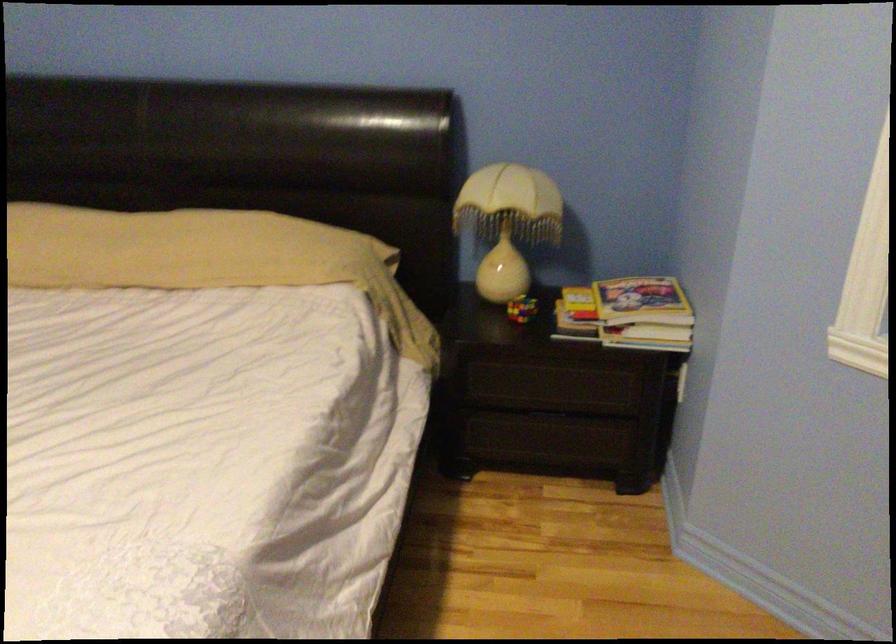
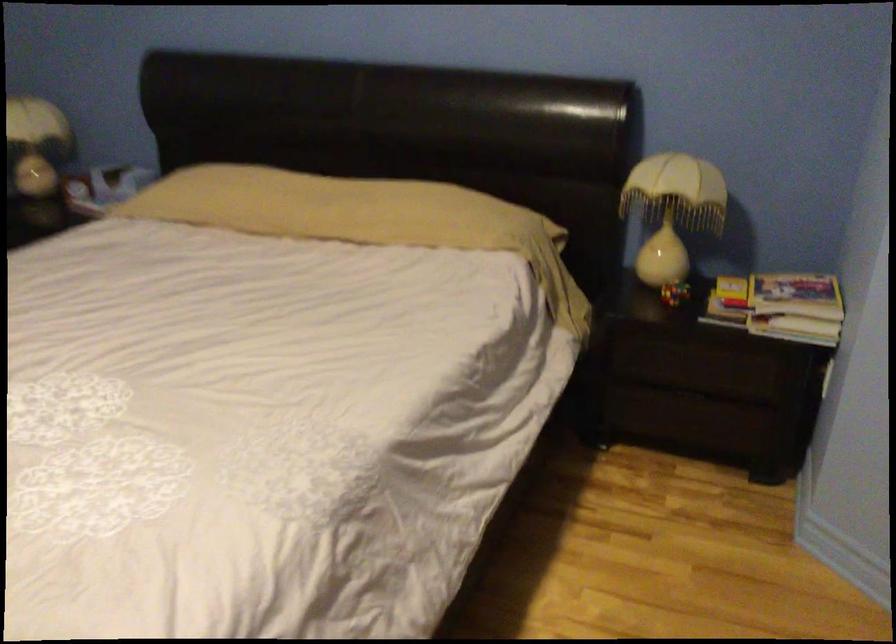
Question: Based on the continuous images, in which direction is the camera rotating? Reply with the corresponding letter.

Choices:
 (A) Left
 (B) Right
 (C) Up
 (D) Down

Answer: (A)